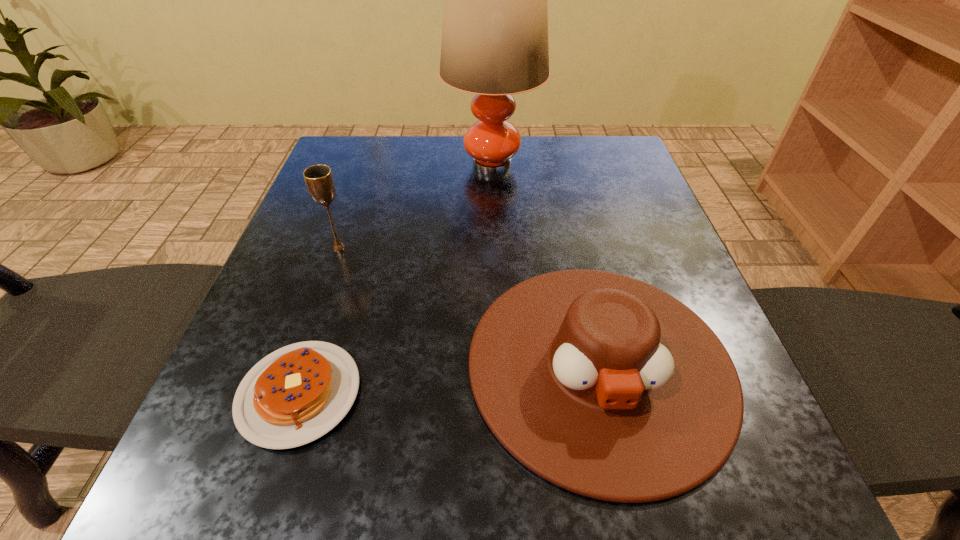
Where is `lamp`? This screenshot has width=960, height=540. lamp is located at coordinates (494, 44).

Find the location of a particular element. This screenshot has height=540, width=960. the farthest object is located at coordinates (494, 44).

You are a GUI agent. You are given a task and a screenshot of the screen. Output one action in this format:
    pyautogui.click(x=<x>, y=<y>)
    Task: Click on the chalice
    
    Given the screenshot: What is the action you would take?
    pyautogui.click(x=319, y=180)

You are a GUI agent. You are given a task and a screenshot of the screen. Output one action in this format:
    pyautogui.click(x=<x>, y=<y>)
    Task: Click on the second tallest object
    The height and width of the screenshot is (540, 960).
    Given the screenshot: What is the action you would take?
    pyautogui.click(x=319, y=180)

Image resolution: width=960 pixels, height=540 pixels. In order to click on the second shortest object in this screenshot , I will do `click(604, 385)`.

The width and height of the screenshot is (960, 540). What are the coordinates of `pancake` in the screenshot? It's located at (296, 394).

Where is `vacant region located on the front of the lamp`? The image size is (960, 540). vacant region located on the front of the lamp is located at coordinates (494, 218).

At what (x,y) coordinates should I click in order to perform the action: click on vacant space located on the back of the third shortest object. Please return your answer as a coordinate pair (x, y). The height and width of the screenshot is (540, 960). Looking at the image, I should click on (371, 156).

Find the location of a particular element. Image resolution: width=960 pixels, height=540 pixels. free space located on the back of the shortest object is located at coordinates (334, 286).

This screenshot has width=960, height=540. I want to click on object that is at the far edge, so click(494, 44).